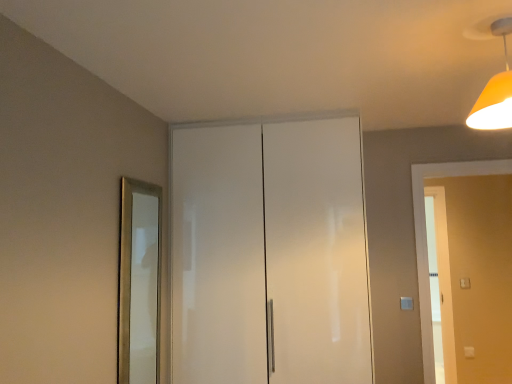
Question: From the image's perspective, is white glossy cabinet at center on top of white glossy door at right?

Choices:
 (A) no
 (B) yes

Answer: (B)

Question: Considering the relative sizes of white glossy cabinet at center and white glossy door at right in the image provided, is white glossy cabinet at center thinner than white glossy door at right?

Choices:
 (A) no
 (B) yes

Answer: (A)

Question: Considering the relative sizes of white glossy cabinet at center and white glossy door at right in the image provided, is white glossy cabinet at center bigger than white glossy door at right?

Choices:
 (A) yes
 (B) no

Answer: (A)

Question: Is white glossy cabinet at center in contact with white glossy door at right?

Choices:
 (A) yes
 (B) no

Answer: (B)

Question: Is white glossy cabinet at center located outside white glossy door at right?

Choices:
 (A) yes
 (B) no

Answer: (A)

Question: Considering the positions of white glossy cabinet at center and orange matte light fixture at upper right in the image, is white glossy cabinet at center bigger or smaller than orange matte light fixture at upper right?

Choices:
 (A) big
 (B) small

Answer: (A)

Question: From the image's perspective, is white glossy cabinet at center above or below orange matte light fixture at upper right?

Choices:
 (A) below
 (B) above

Answer: (A)

Question: Does point (179, 130) appear closer or farther from the camera than point (484, 127)?

Choices:
 (A) closer
 (B) farther

Answer: (B)

Question: Choose the correct answer: Is white glossy cabinet at center inside orange matte light fixture at upper right or outside it?

Choices:
 (A) outside
 (B) inside

Answer: (A)

Question: Is point pos(496,81) positioned closer to the camera than point pos(175,208)?

Choices:
 (A) farther
 (B) closer

Answer: (B)

Question: Looking at the image, does orange matte light fixture at upper right seem bigger or smaller compared to white glossy cabinet at center?

Choices:
 (A) small
 (B) big

Answer: (A)

Question: From the image's perspective, is orange matte light fixture at upper right located above or below white glossy cabinet at center?

Choices:
 (A) below
 (B) above

Answer: (B)

Question: Choose the correct answer: Is orange matte light fixture at upper right inside white glossy cabinet at center or outside it?

Choices:
 (A) inside
 (B) outside

Answer: (B)

Question: Relative to white glossy cabinet at center, is gold metallic mirror at left in front or behind?

Choices:
 (A) front
 (B) behind

Answer: (A)

Question: Considering the positions of point (147, 241) and point (355, 142), is point (147, 241) closer or farther from the camera than point (355, 142)?

Choices:
 (A) farther
 (B) closer

Answer: (A)